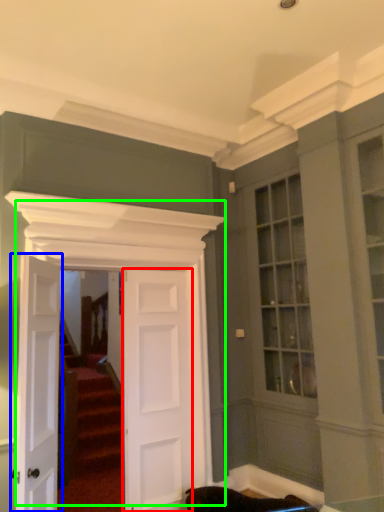
Question: Which object is positioned closest to door (highlighted by a red box)? Select from door (highlighted by a blue box) and door (highlighted by a green box).

Choices:
 (A) door
 (B) door

Answer: (B)